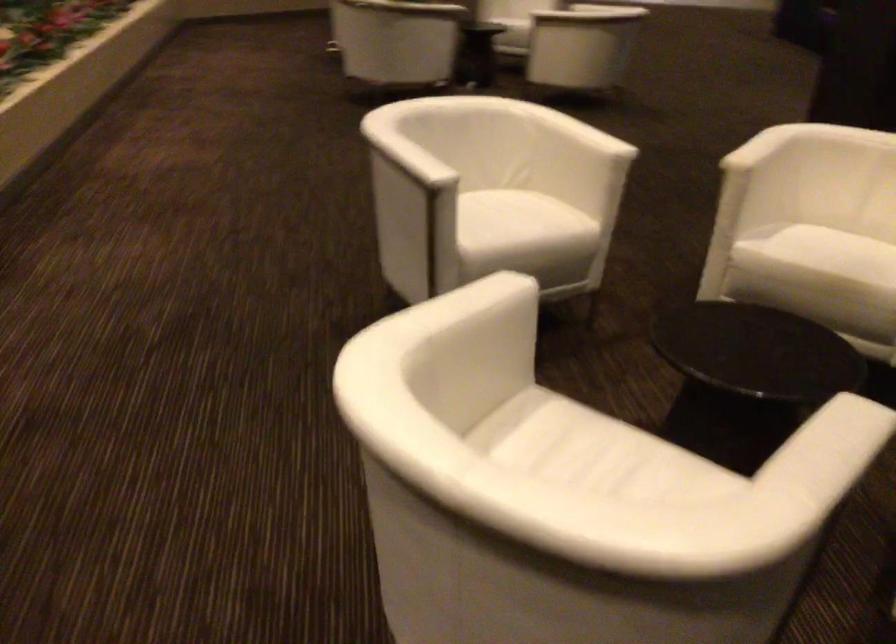
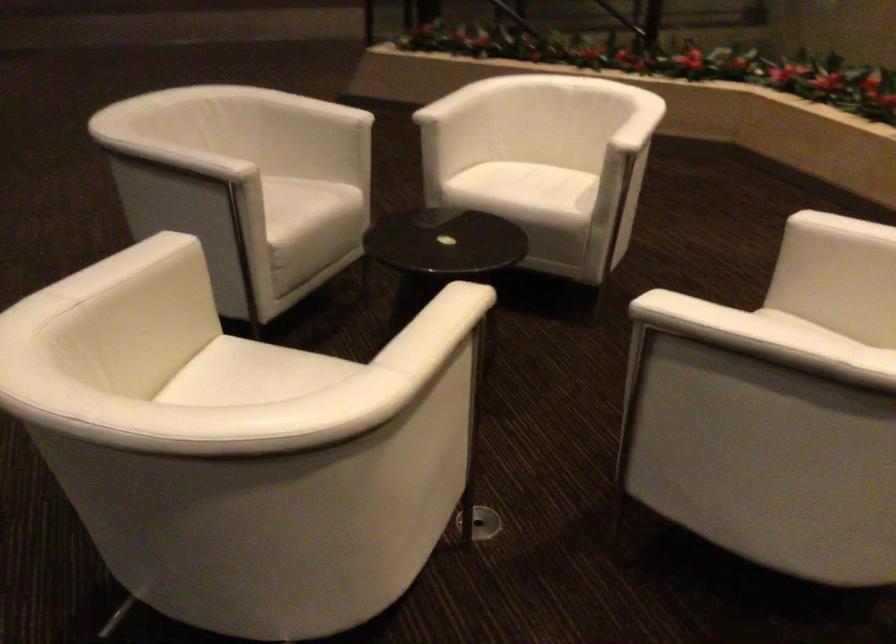
In the second image, find the point that corresponds to (x=767, y=146) in the first image.

(437, 308)